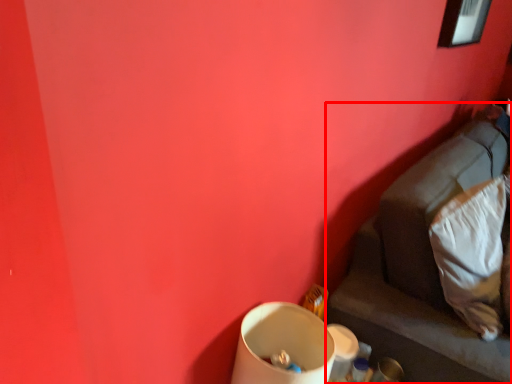
Question: In this image, where is furniture (annotated by the red box) located relative to pillow?

Choices:
 (A) right
 (B) left

Answer: (A)